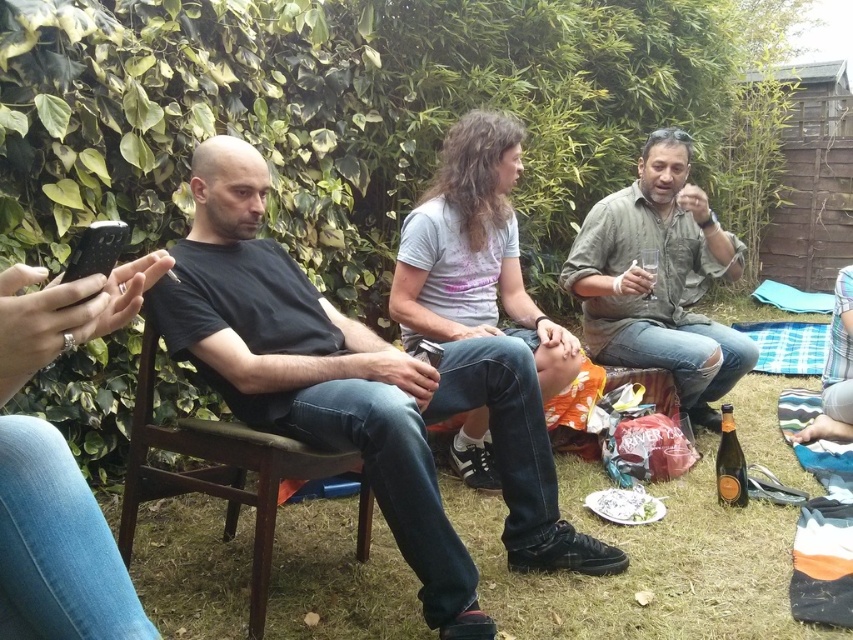
Question: Is brown wooden chair at center to the right of white crumpled paper at lower center from the viewer's perspective?

Choices:
 (A) no
 (B) yes

Answer: (A)

Question: Which is nearer to the white crumpled paper at lower center?

Choices:
 (A) matte brown shirt at center
 (B) black matte t-shirt at left
 (C) brown wooden chair at center

Answer: (B)

Question: Based on their relative distances, which object is nearer to the brown wooden chair at center?

Choices:
 (A) white crumpled paper at lower center
 (B) black matte t-shirt at left
 (C) matte brown shirt at center

Answer: (B)

Question: Which of the following is the closest to the observer?

Choices:
 (A) matte brown shirt at center
 (B) white crumpled paper at lower center

Answer: (B)

Question: Does black matte t-shirt at left have a smaller size compared to white crumpled paper at lower center?

Choices:
 (A) no
 (B) yes

Answer: (A)

Question: Is black matte t-shirt at left above matte brown shirt at center?

Choices:
 (A) no
 (B) yes

Answer: (A)